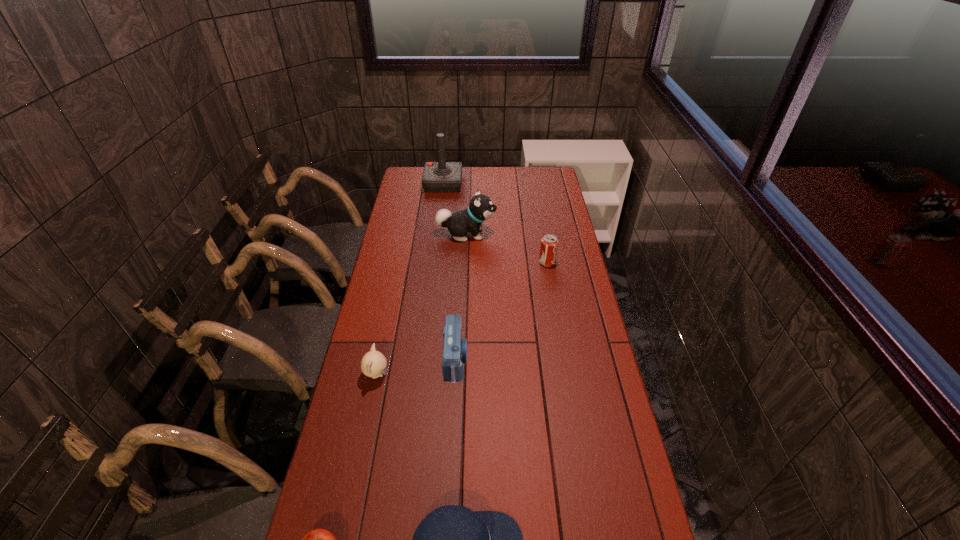
In order to click on vacant area at the right edge of the desktop in this screenshot , I will do `click(563, 294)`.

Where is `blank space at the far right corner of the desktop`? blank space at the far right corner of the desktop is located at coordinates (538, 170).

Identify the location of object that stands as the third closest to the camera. Image resolution: width=960 pixels, height=540 pixels. (549, 243).

Locate an element on the screen. object that stands as the closest to the tallest object is located at coordinates (481, 207).

Identify the location of vacant space that satisfies the following two spatial constraints: 1. on the rectangular base of the rightmost object; 2. on the left side of the joystick. Image resolution: width=960 pixels, height=540 pixels. (434, 262).

Where is `free location that satisfies the following two spatial constraints: 1. on the rectangular base of the joystick; 2. on the right side of the fifth nearest object`? free location that satisfies the following two spatial constraints: 1. on the rectangular base of the joystick; 2. on the right side of the fifth nearest object is located at coordinates (434, 262).